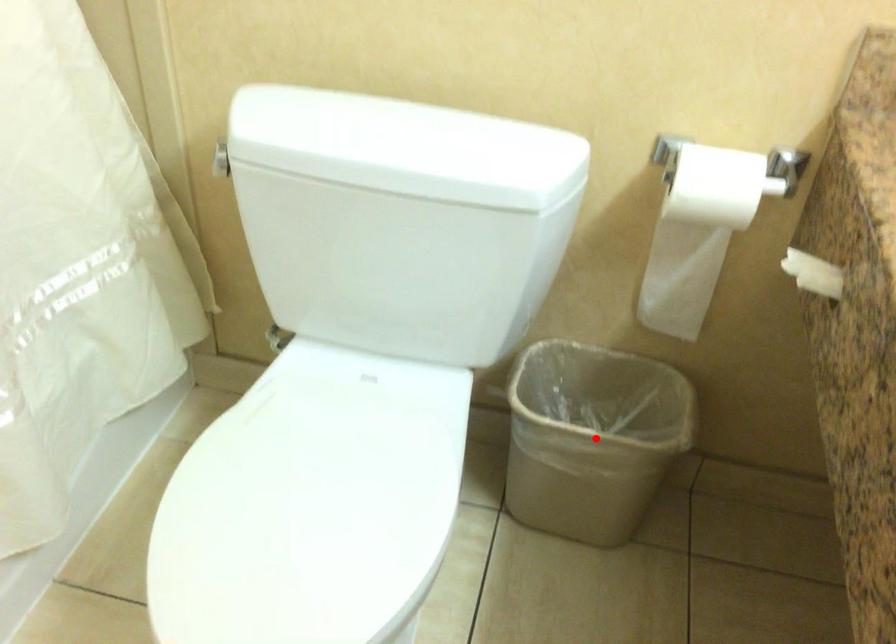
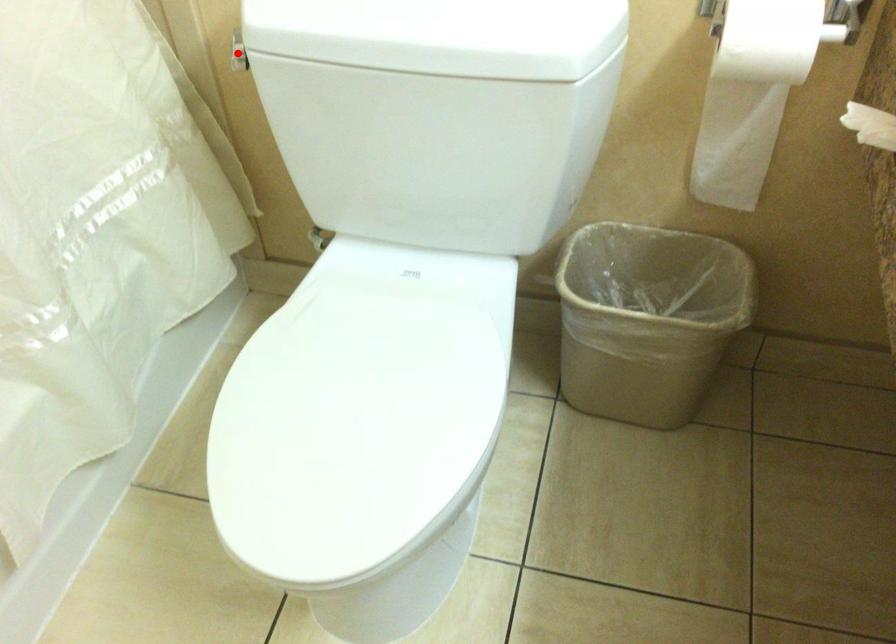
From the picture: I am providing you with two images of the same scene from different viewpoints. A red point is marked on the first image and another point is marked on the second image. Is the red point in image1 aligned with the point shown in image2?

No